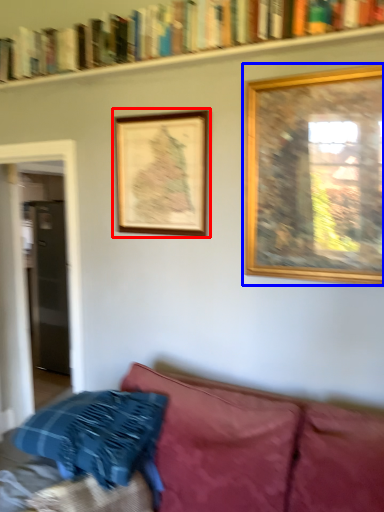
Question: Which point is closer to the camera, picture frame (highlighted by a red box) or picture frame (highlighted by a blue box)?

Choices:
 (A) picture frame
 (B) picture frame

Answer: (B)